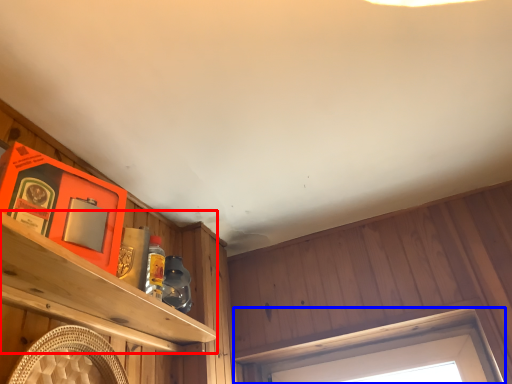
Question: Which of the following is the closest to the observer, shelf (highlighted by a red box) or window (highlighted by a blue box)?

Choices:
 (A) shelf
 (B) window

Answer: (A)